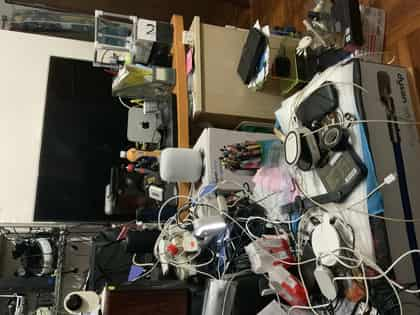
I want to click on floor, so click(x=407, y=28).